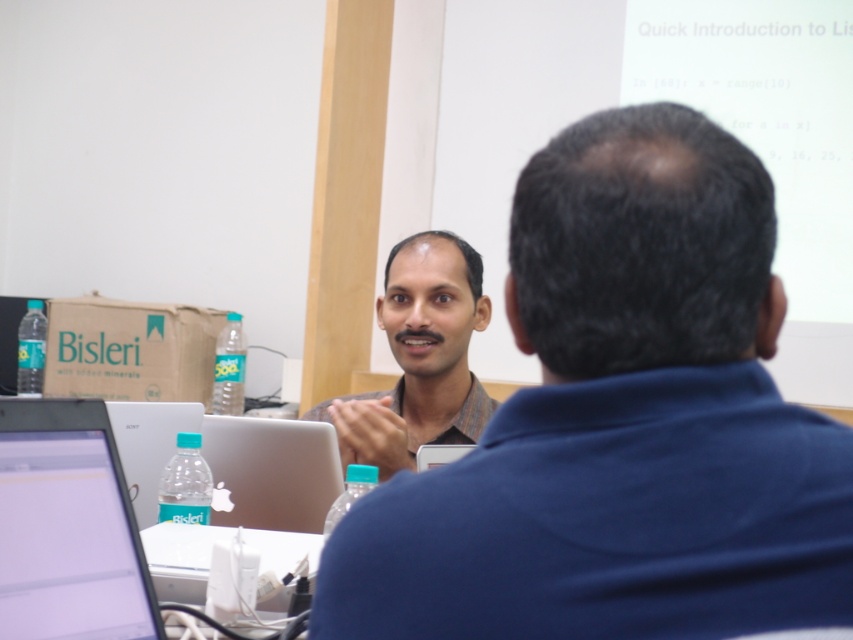
You are a photographer trying to capture a closeup of both the matte brown shirt at center and the satin silver laptop at center. Since you can only focus on one object at a time, which one should you choose to ensure the other is still in focus?

The matte brown shirt at center is wider than the satin silver laptop at center, so focusing on the wider object will keep the narrower one in focus.

Based on the photo, you are sitting at the table and want to grab the silver metallic laptop at center to show a presentation. Which direction should you reach to pick it up compared to the satin silver laptop at center?

The silver metallic laptop at center is on the right side of the satin silver laptop at center, so you should reach to your right to pick it up.